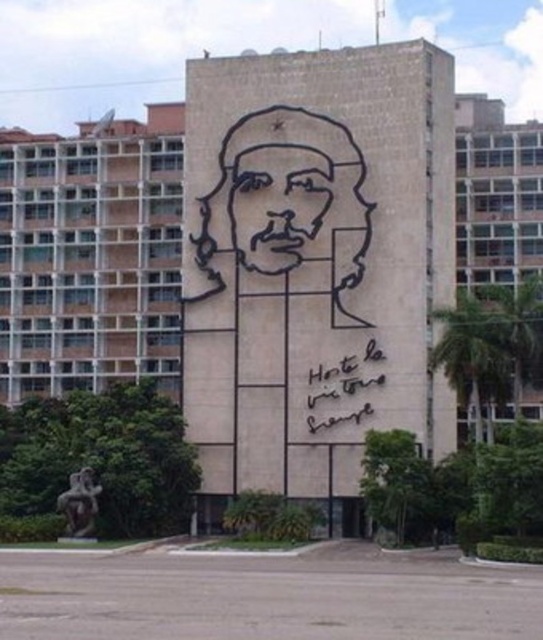
Does black wire sculpture at center come behind black calligraphy at lower right?

No, black wire sculpture at center is closer to the viewer.

You are a GUI agent. You are given a task and a screenshot of the screen. Output one action in this format:
    pyautogui.click(x=<x>, y=<y>)
    Task: Click on the black wire sculpture at center
    Image resolution: width=543 pixels, height=640 pixels.
    Given the screenshot: What is the action you would take?
    pyautogui.click(x=287, y=205)

Where is `black wire sculpture at center`? black wire sculpture at center is located at coordinates (287, 205).

Can you confirm if black wire sculpture at center is wider than black wireframe face at center?

Correct, the width of black wire sculpture at center exceeds that of black wireframe face at center.

Where is `black wire sculpture at center`? black wire sculpture at center is located at coordinates (287, 205).

Between black wireframe face at center and black calligraphy at lower right, which one has less height?

With less height is black wireframe face at center.

Who is lower down, black wireframe face at center or black calligraphy at lower right?

black calligraphy at lower right is lower down.

Is point (312, 230) positioned in front of point (332, 371)?

No.

Where is `black wireframe face at center`? This screenshot has width=543, height=640. black wireframe face at center is located at coordinates (277, 204).